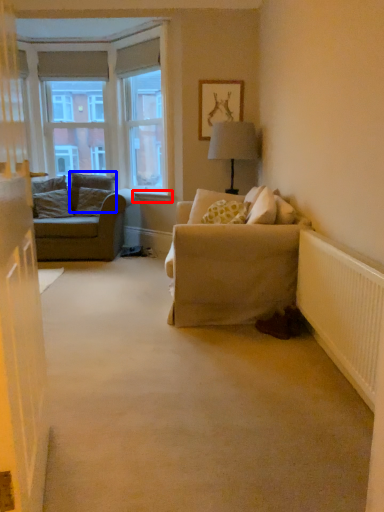
Question: Which object is further to the camera taking this photo, window sill (highlighted by a red box) or pillow (highlighted by a blue box)?

Choices:
 (A) window sill
 (B) pillow

Answer: (B)